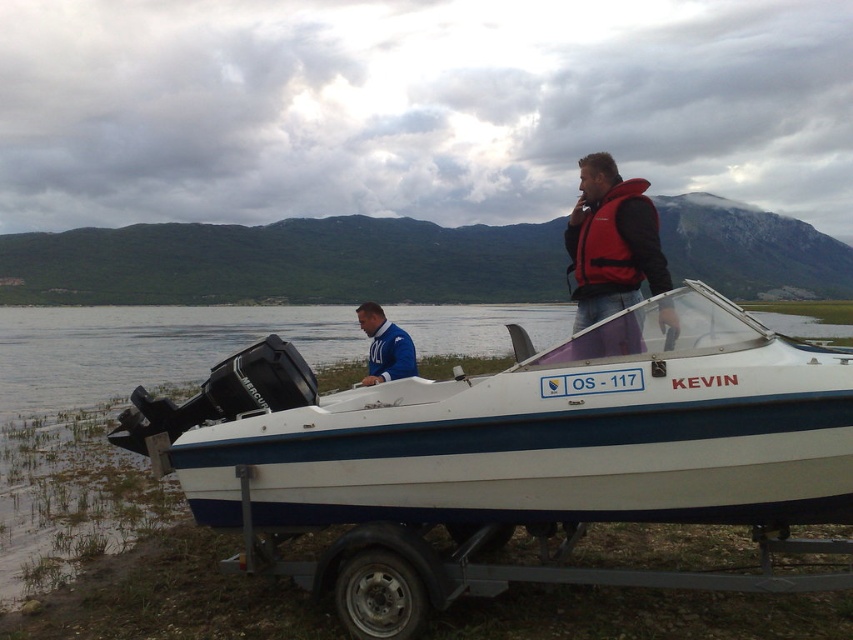
Question: From the image, what is the correct spatial relationship of white glossy boat at center in relation to blue fleece jacket at center?

Choices:
 (A) left
 (B) right

Answer: (B)

Question: Which point is farther to the camera?

Choices:
 (A) [631, 269]
 (B) [573, 323]
 (C) [836, 369]
 (D) [369, 348]

Answer: (D)

Question: Estimate the real-world distances between objects in this image. Which object is farther from the white glossy boat at center?

Choices:
 (A) red life vest at upper center
 (B) red nylon life jacket at upper center
 (C) blue fleece jacket at center

Answer: (C)

Question: Does white glossy boat at center appear over blue fleece jacket at center?

Choices:
 (A) yes
 (B) no

Answer: (B)

Question: Estimate the real-world distances between objects in this image. Which object is farther from the red nylon life jacket at upper center?

Choices:
 (A) white glossy boat at center
 (B) blue fleece jacket at center

Answer: (B)

Question: Is red nylon life jacket at upper center closer to camera compared to blue fleece jacket at center?

Choices:
 (A) yes
 (B) no

Answer: (A)